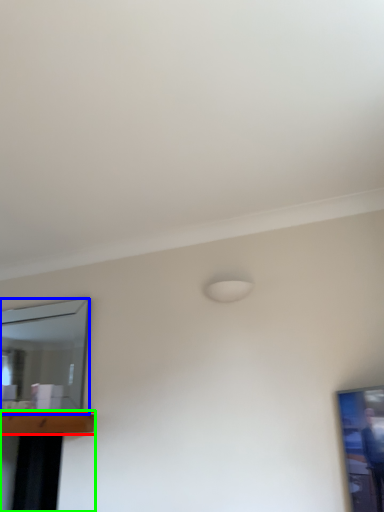
Question: Which is nearer to the table (highlighted by a red box)? mirror (highlighted by a blue box) or table (highlighted by a green box).

Choices:
 (A) mirror
 (B) table

Answer: (A)